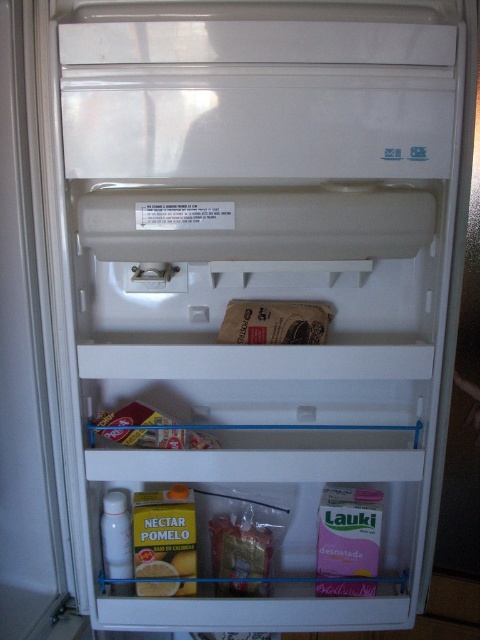
Question: Which of the following is the closest to the observer?

Choices:
 (A) [144, 428]
 (B) [243, 534]

Answer: (A)

Question: Is brown paper bag at center wider than translucent plastic bag at lower center?

Choices:
 (A) no
 (B) yes

Answer: (B)

Question: Which point is farther to the camera?

Choices:
 (A) (132, 433)
 (B) (286, 340)
 (C) (237, 586)

Answer: (C)

Question: From the image, what is the correct spatial relationship of brown paper bag at center in relation to matte cardboard box at center?

Choices:
 (A) left
 (B) right

Answer: (B)

Question: Is brown paper bag at center to the right of translucent plastic bag at lower center from the viewer's perspective?

Choices:
 (A) yes
 (B) no

Answer: (A)

Question: Which point is farther from the camera taking this photo?

Choices:
 (A) (100, 432)
 (B) (244, 513)
 (C) (272, 307)

Answer: (B)